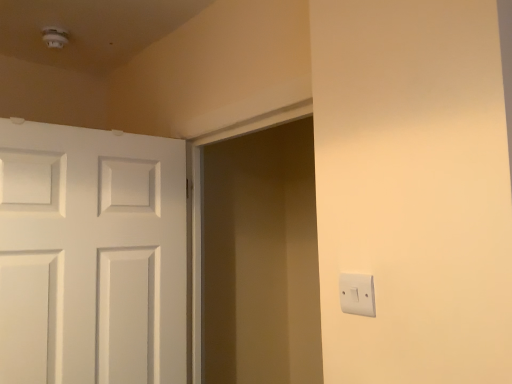
Question: Is white plastic light switch at right positioned far away from matte white screen door at center?

Choices:
 (A) yes
 (B) no

Answer: (A)

Question: From the image's perspective, does white plastic light switch at right appear higher than matte white screen door at center?

Choices:
 (A) yes
 (B) no

Answer: (A)

Question: From the image's perspective, is white plastic light switch at right beneath matte white screen door at center?

Choices:
 (A) no
 (B) yes

Answer: (A)

Question: Is white plastic light switch at right closer to the viewer compared to matte white screen door at center?

Choices:
 (A) yes
 (B) no

Answer: (A)

Question: From a real-world perspective, is white plastic light switch at right over matte white screen door at center?

Choices:
 (A) no
 (B) yes

Answer: (A)

Question: Is white plastic light switch at right further to camera compared to matte white screen door at center?

Choices:
 (A) yes
 (B) no

Answer: (B)

Question: From a real-world perspective, is white painted wood door at left on white plastic light switch at right?

Choices:
 (A) no
 (B) yes

Answer: (B)

Question: Is white painted wood door at left bigger than white plastic light switch at right?

Choices:
 (A) yes
 (B) no

Answer: (A)

Question: Considering the relative sizes of white painted wood door at left and white plastic light switch at right in the image provided, is white painted wood door at left shorter than white plastic light switch at right?

Choices:
 (A) no
 (B) yes

Answer: (A)

Question: Is white painted wood door at left positioned in front of white plastic light switch at right?

Choices:
 (A) yes
 (B) no

Answer: (B)

Question: Is white painted wood door at left facing towards white plastic light switch at right?

Choices:
 (A) yes
 (B) no

Answer: (A)

Question: Is white painted wood door at left surrounding white plastic light switch at right?

Choices:
 (A) yes
 (B) no

Answer: (B)

Question: From a real-world perspective, is white plastic light switch at right beneath white painted wood door at left?

Choices:
 (A) no
 (B) yes

Answer: (B)